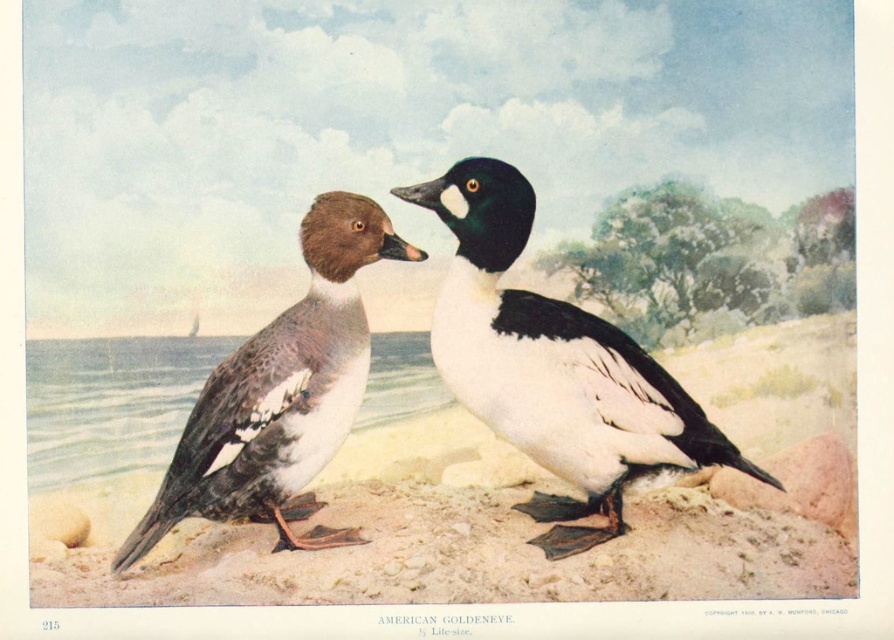
You are standing on the beach and want to take a photo of the smooth sand at lower center. If your camera can focus on objects up to 6 feet away, will you need to move closer or farther away to capture the sand properly?

The smooth sand at lower center is 6.48 feet away from the camera. Since the camera can focus up to 6 feet, you need to move closer to ensure the smooth sand at lower center is within the focus range.

You are standing on the beach looking towards the horizon. You see the smooth sand at lower center and the smooth gray water at lower left. Which one is closer to your current position?

The smooth sand at lower center is closer to your current position because it is in front of the smooth gray water at lower left.